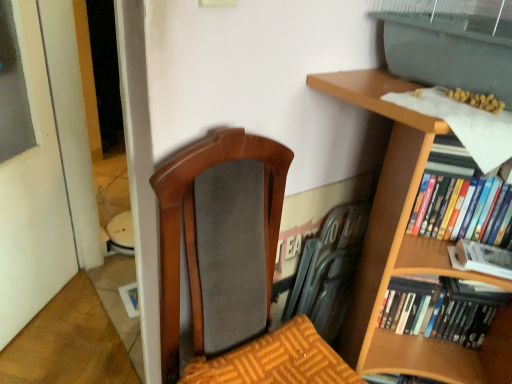
Question: Does white matte book at right, the second book ordered from the bottom, come behind matte black swivel chair at center?

Choices:
 (A) yes
 (B) no

Answer: (B)

Question: Can you confirm if white matte book at right, the second book ordered from the bottom, is positioned to the left of matte black swivel chair at center?

Choices:
 (A) yes
 (B) no

Answer: (B)

Question: From the image's perspective, would you say white matte book at right, the second book ordered from the bottom, is positioned over matte black swivel chair at center?

Choices:
 (A) yes
 (B) no

Answer: (B)

Question: Is white matte book at right, positioned as the second book in top-to-bottom order, outside matte black swivel chair at center?

Choices:
 (A) yes
 (B) no

Answer: (A)

Question: Is white matte book at right, the second book ordered from the bottom, closer to camera compared to matte black swivel chair at center?

Choices:
 (A) yes
 (B) no

Answer: (A)

Question: From a real-world perspective, is white matte book at right, positioned as the second book in top-to-bottom order, under matte black swivel chair at center?

Choices:
 (A) no
 (B) yes

Answer: (A)

Question: Is hardcover books at right, acting as the first book starting from the bottom, taller than white matte book at right, the second book ordered from the bottom?

Choices:
 (A) yes
 (B) no

Answer: (A)

Question: Is hardcover books at right, acting as the first book starting from the bottom, to the right of white matte book at right, positioned as the second book in top-to-bottom order, from the viewer's perspective?

Choices:
 (A) no
 (B) yes

Answer: (A)

Question: Is hardcover books at right, acting as the first book starting from the bottom, positioned with its back to white matte book at right, the second book ordered from the bottom?

Choices:
 (A) yes
 (B) no

Answer: (B)

Question: Considering the relative positions of hardcover books at right, marked as the third book in a top-to-bottom arrangement, and white matte book at right, positioned as the second book in top-to-bottom order, in the image provided, is hardcover books at right, marked as the third book in a top-to-bottom arrangement, in front of white matte book at right, positioned as the second book in top-to-bottom order,?

Choices:
 (A) yes
 (B) no

Answer: (B)

Question: From a real-world perspective, is hardcover books at right, acting as the first book starting from the bottom, positioned over white matte book at right, the second book ordered from the bottom, based on gravity?

Choices:
 (A) yes
 (B) no

Answer: (B)

Question: Is hardcover books at right, marked as the third book in a top-to-bottom arrangement, behind white matte book at right, positioned as the second book in top-to-bottom order?

Choices:
 (A) yes
 (B) no

Answer: (A)

Question: From the image's perspective, is hardcover books at right, which is the third book in bottom-to-top order, on matte black swivel chair at center?

Choices:
 (A) no
 (B) yes

Answer: (B)